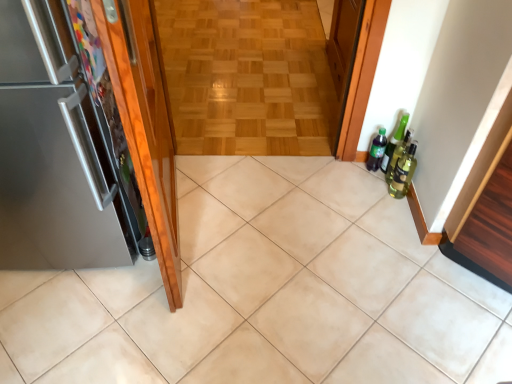
Find the location of a particular element. vacant space that's between satin metallic refrigerator at left, the 1th door in the left-to-right sequence, and green glass bottle at right, which ranks as the 2th beer bottle in back-to-front order is located at coordinates (269, 211).